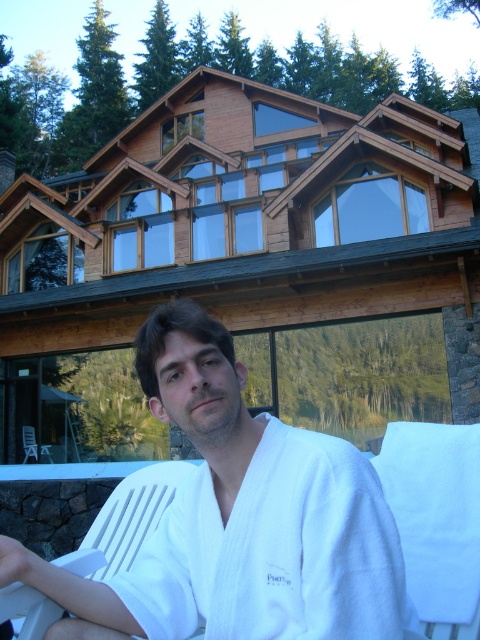
Question: Is wooden cabin at upper center positioned at the back of white plastic chair at lower left?

Choices:
 (A) no
 (B) yes

Answer: (A)

Question: Is white cotton bathrobe at center thinner than white plastic chair at lower left?

Choices:
 (A) no
 (B) yes

Answer: (B)

Question: Which of the following is the closest to the observer?

Choices:
 (A) white plastic beach chair at lower left
 (B) white plastic chair at lower left
 (C) wooden cabin at upper center

Answer: (A)

Question: Considering the relative positions of wooden cabin at upper center and white fabric chair at lower right in the image provided, where is wooden cabin at upper center located with respect to white fabric chair at lower right?

Choices:
 (A) right
 (B) left

Answer: (B)

Question: Considering the real-world distances, which object is closest to the white cotton bathrobe at center?

Choices:
 (A) white plastic chair at lower left
 (B) white fabric chair at lower right

Answer: (B)

Question: Which object is positioned closest to the white cotton bathrobe at center?

Choices:
 (A) white plastic beach chair at lower left
 (B) white fabric chair at lower right
 (C) wooden cabin at upper center

Answer: (B)